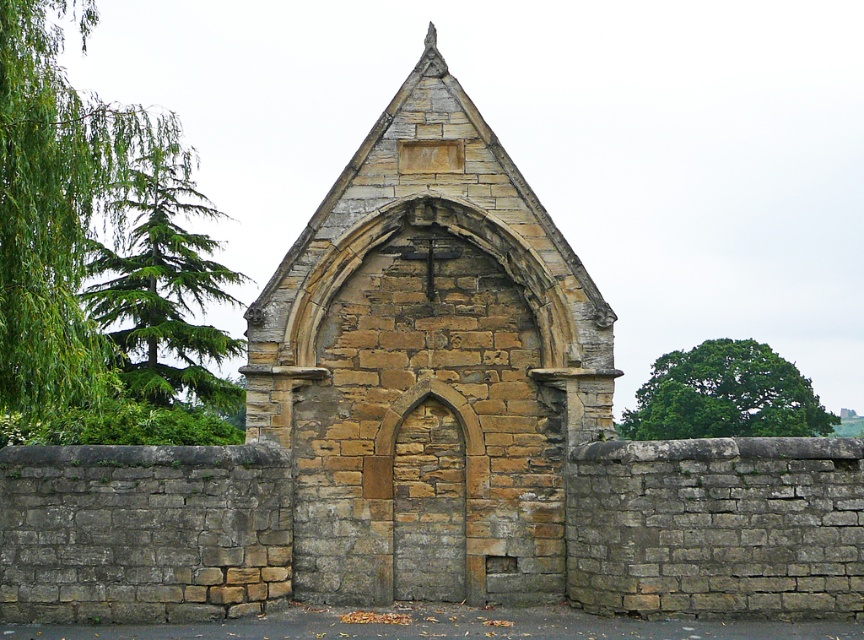
Which is in front, point (112, 308) or point (751, 364)?

Point (112, 308) is in front.

Is point (226, 384) farther from viewer compared to point (636, 429)?

No, (226, 384) is closer to viewer.

What do you see at coordinates (162, 280) in the screenshot? The image size is (864, 640). I see `green needle-like leaves at left` at bounding box center [162, 280].

Find the location of a particular element. The width and height of the screenshot is (864, 640). green needle-like leaves at left is located at coordinates (162, 280).

Can you confirm if yellow stone church at center is thinner than green leafy tree at upper right?

Yes.

Is point (417, 544) more distant than point (785, 360)?

No, it is in front of (785, 360).

What are the coordinates of `yellow stone church at center` in the screenshot? It's located at (x=429, y=365).

Consider the image. Can you confirm if yellow stone church at center is smaller than green needle-like leaves at left?

Yes, yellow stone church at center is smaller than green needle-like leaves at left.

Image resolution: width=864 pixels, height=640 pixels. What are the coordinates of `yellow stone church at center` in the screenshot? It's located at (429, 365).

Is point (369, 381) less distant than point (185, 252)?

Yes, point (369, 381) is in front of point (185, 252).

Find the location of a particular element. The image size is (864, 640). yellow stone church at center is located at coordinates 429,365.